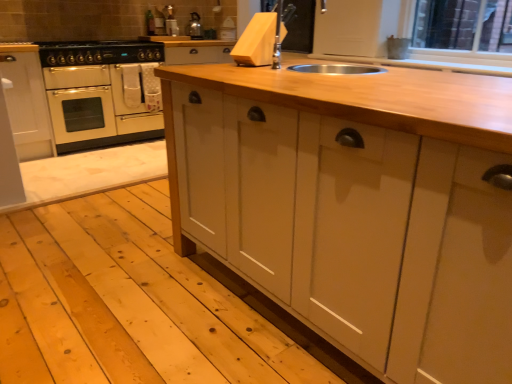
Question: Is cream matte oven at left oriented away from metallic silver kettle at upper center?

Choices:
 (A) yes
 (B) no

Answer: (B)

Question: From the image's perspective, is cream matte oven at left beneath metallic silver kettle at upper center?

Choices:
 (A) yes
 (B) no

Answer: (A)

Question: Is cream matte oven at left wider than metallic silver kettle at upper center?

Choices:
 (A) yes
 (B) no

Answer: (A)

Question: From a real-world perspective, is cream matte oven at left on top of metallic silver kettle at upper center?

Choices:
 (A) yes
 (B) no

Answer: (B)

Question: From the image's perspective, would you say cream matte oven at left is positioned over metallic silver kettle at upper center?

Choices:
 (A) no
 (B) yes

Answer: (A)

Question: Would you say metallic silver kettle at upper center is to the left or to the right of black matte gas stove at upper left in the picture?

Choices:
 (A) right
 (B) left

Answer: (A)

Question: Is metallic silver kettle at upper center inside or outside of black matte gas stove at upper left?

Choices:
 (A) outside
 (B) inside

Answer: (A)

Question: In the image, is metallic silver kettle at upper center positioned in front of or behind black matte gas stove at upper left?

Choices:
 (A) behind
 (B) front

Answer: (A)

Question: From the image's perspective, relative to black matte gas stove at upper left, is metallic silver kettle at upper center above or below?

Choices:
 (A) below
 (B) above

Answer: (B)

Question: Choose the correct answer: Is white matte cabinet at left inside metallic silver kettle at upper center or outside it?

Choices:
 (A) outside
 (B) inside

Answer: (A)

Question: From the image's perspective, relative to metallic silver kettle at upper center, is white matte cabinet at left above or below?

Choices:
 (A) below
 (B) above

Answer: (A)

Question: In terms of width, does white matte cabinet at left look wider or thinner when compared to metallic silver kettle at upper center?

Choices:
 (A) wide
 (B) thin

Answer: (A)

Question: Considering the positions of white matte cabinet at left and metallic silver kettle at upper center in the image, is white matte cabinet at left taller or shorter than metallic silver kettle at upper center?

Choices:
 (A) short
 (B) tall

Answer: (B)

Question: From their relative heights in the image, would you say white matte cabinet at left is taller or shorter than black matte gas stove at upper left?

Choices:
 (A) short
 (B) tall

Answer: (B)

Question: From the image's perspective, is white matte cabinet at left positioned above or below black matte gas stove at upper left?

Choices:
 (A) above
 (B) below

Answer: (B)